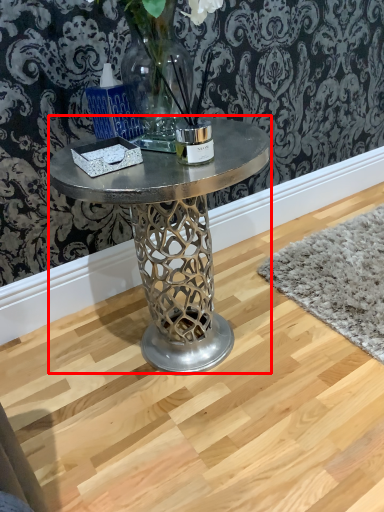
Question: From the image's perspective, where is coffee table (annotated by the red box) located in relation to candle holder in the image?

Choices:
 (A) below
 (B) above

Answer: (A)